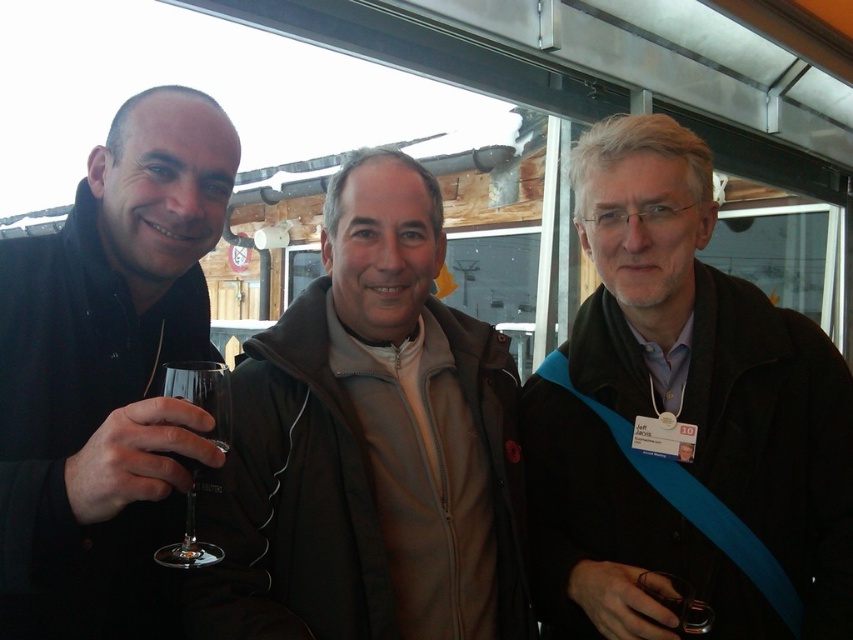
Question: Is the position of matte black jacket at right more distant than that of transparent glass at left?

Choices:
 (A) no
 (B) yes

Answer: (B)

Question: Which object is farther from the camera taking this photo?

Choices:
 (A) matte black jacket at right
 (B) transparent glass at left
 (C) matte black jacket at left

Answer: (A)

Question: Which point appears closest to the camera in this image?

Choices:
 (A) (223, 116)
 (B) (190, 522)
 (C) (788, 611)

Answer: (B)

Question: Is the position of matte black jacket at right more distant than that of khaki zip-up jacket at center?

Choices:
 (A) yes
 (B) no

Answer: (B)

Question: From the image, what is the correct spatial relationship of matte black jacket at right in relation to transparent glass at left?

Choices:
 (A) right
 (B) left

Answer: (A)

Question: Which of these objects is positioned closest to the transparent glass at left?

Choices:
 (A) matte black jacket at left
 (B) khaki zip-up jacket at center

Answer: (A)